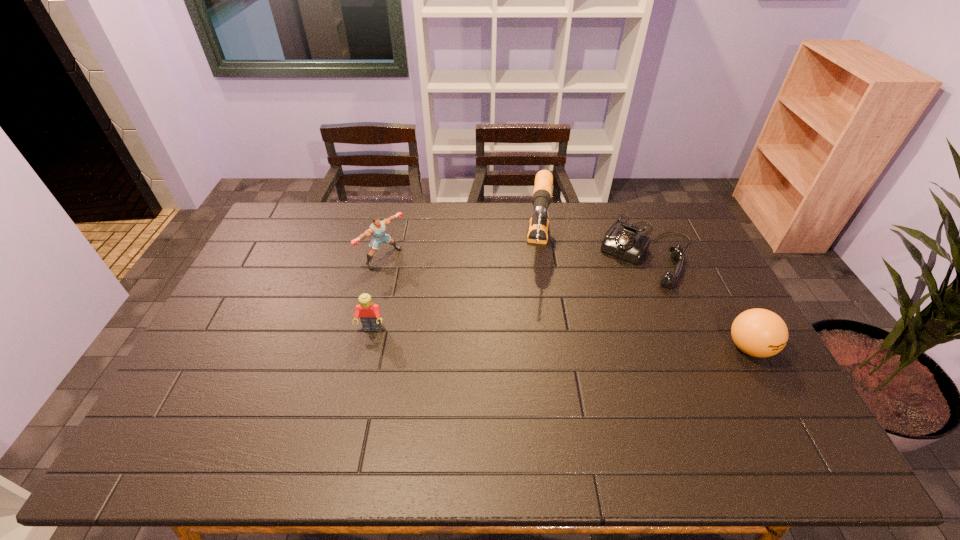
The width and height of the screenshot is (960, 540). What are the coordinates of `ping-pong ball that is at the right edge` in the screenshot? It's located at (758, 332).

At what (x,y) coordinates should I click in order to perform the action: click on telephone present at the right edge. Please return your answer as a coordinate pair (x, y). Looking at the image, I should click on (625, 242).

The height and width of the screenshot is (540, 960). What are the coordinates of `object located in the far right corner section of the desktop` in the screenshot? It's located at (625, 242).

In the image, there is a desktop. Identify the location of vacant space at the far edge. The width and height of the screenshot is (960, 540). (589, 207).

This screenshot has width=960, height=540. What are the coordinates of `vacant space at the near edge of the desktop` in the screenshot? It's located at (676, 404).

Where is `free space at the left edge of the desktop`? Image resolution: width=960 pixels, height=540 pixels. free space at the left edge of the desktop is located at coordinates (273, 267).

The width and height of the screenshot is (960, 540). Find the location of `free spot at the right edge of the desktop`. free spot at the right edge of the desktop is located at coordinates (708, 343).

This screenshot has width=960, height=540. Find the location of `free space at the far left corner of the desktop`. free space at the far left corner of the desktop is located at coordinates (310, 205).

Where is `blank space at the far right corner`? The height and width of the screenshot is (540, 960). blank space at the far right corner is located at coordinates (644, 211).

At what (x,y) coordinates should I click in order to perform the action: click on free space between the telephone and the ping-pong ball. Please return your answer as a coordinate pair (x, y). Looking at the image, I should click on (698, 299).